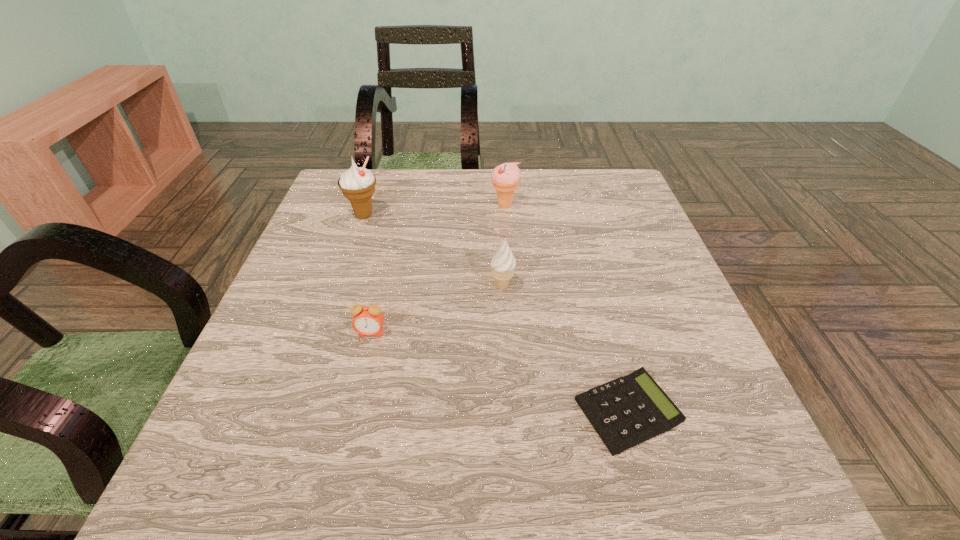
Identify the location of free space between the nearest icecream and the leftmost object. This screenshot has width=960, height=540. (433, 251).

I want to click on free spot between the nearest icecream and the leftmost icecream, so click(x=433, y=251).

The width and height of the screenshot is (960, 540). I want to click on object that is the second closest one to the alarm clock, so pyautogui.click(x=357, y=184).

Locate an element on the screen. The width and height of the screenshot is (960, 540). object that stands as the third closest to the nearest icecream is located at coordinates (505, 177).

Select which icecream appears as the second closest to the rightmost object. Please provide its 2D coordinates. Your answer should be formatted as a tuple, i.e. [(x, y)], where the tuple contains the x and y coordinates of a point satisfying the conditions above.

[(505, 177)]

Choose which icecream is the third nearest neighbor to the second object from left to right. Please provide its 2D coordinates. Your answer should be formatted as a tuple, i.e. [(x, y)], where the tuple contains the x and y coordinates of a point satisfying the conditions above.

[(505, 177)]

Find the location of a particular element. The image size is (960, 540). free space that satisfies the following two spatial constraints: 1. on the back side of the nearest object; 2. on the front-facing side of the third farthest object is located at coordinates (593, 287).

Image resolution: width=960 pixels, height=540 pixels. I want to click on free space that satisfies the following two spatial constraints: 1. on the front-facing side of the third nearest object; 2. on the back side of the shortest object, so click(509, 411).

Where is `free spot that satisfies the following two spatial constraints: 1. on the face of the second shortest object; 2. on the left side of the calculator`? free spot that satisfies the following two spatial constraints: 1. on the face of the second shortest object; 2. on the left side of the calculator is located at coordinates (352, 411).